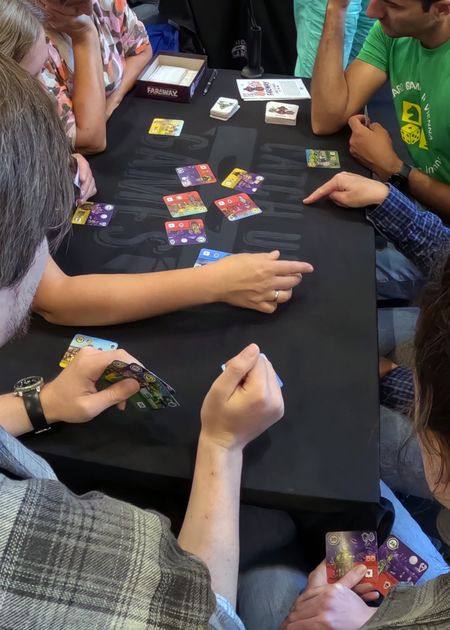
Where is `playing cards of people at table`? The height and width of the screenshot is (630, 450). playing cards of people at table is located at coordinates (232, 210), (199, 172), (323, 155), (150, 390), (358, 545).